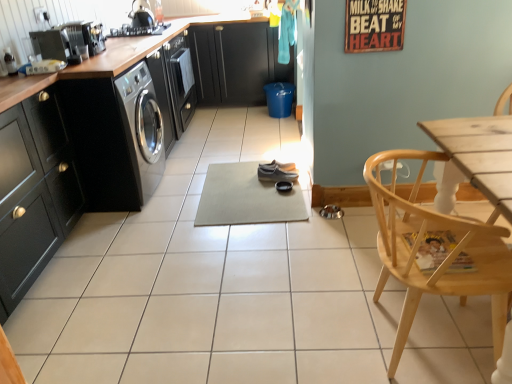
You are a GUI agent. You are given a task and a screenshot of the screen. Output one action in this format:
    pyautogui.click(x=<x>, y=<y>)
    Task: Click on the matte black cabinets at center, the 2th cabinetry from the front
    The width and height of the screenshot is (512, 384).
    Given the screenshot: What is the action you would take?
    pyautogui.click(x=236, y=63)

What do you see at coordinates (111, 58) in the screenshot? Image resolution: width=512 pixels, height=384 pixels. I see `wooden at left` at bounding box center [111, 58].

Measure the distance between metallic silver toaster at upper left and camera.

metallic silver toaster at upper left is 2.45 meters from camera.

What do you see at coordinates (246, 198) in the screenshot? I see `beige rubber yoga mat at center` at bounding box center [246, 198].

You are a GUI agent. You are given a task and a screenshot of the screen. Output one action in this format:
    pyautogui.click(x=<x>, y=<y>)
    Task: Click on the shiny black kettle at upper left
    The width and height of the screenshot is (512, 384).
    Given the screenshot: What is the action you would take?
    pyautogui.click(x=142, y=14)

Measure the distance between point (295,180) and camera.

9.65 feet.

Identify the location of light wood chair at lower right. (435, 251).

In the scene shown: Is light wood chair at lower right next to matte black cabinet at left, positioned as the 1th cabinetry in left-to-right order, and touching it?

No, light wood chair at lower right is not making contact with matte black cabinet at left, positioned as the 1th cabinetry in left-to-right order.

From a real-world perspective, is light wood chair at lower right physically located above or below matte black cabinet at left, acting as the second cabinetry starting from the top?

From a real-world perspective, light wood chair at lower right is physically below matte black cabinet at left, acting as the second cabinetry starting from the top.

Looking at this image, relative to matte black cabinet at left, positioned as the second cabinetry in back-to-front order, is light wood chair at lower right in front or behind?

Visually, light wood chair at lower right is located in front of matte black cabinet at left, positioned as the second cabinetry in back-to-front order.

Considering the positions of points (379, 225) and (31, 223), is point (379, 225) closer to camera compared to point (31, 223)?

Yes, point (379, 225) is in front of point (31, 223).

Is point (391, 226) positioned before point (289, 179)?

That is True.

Considering the relative positions of light wood chair at lower right and matte gray shoe at center in the image provided, is light wood chair at lower right to the left of matte gray shoe at center from the viewer's perspective?

No, light wood chair at lower right is not to the left of matte gray shoe at center.

Looking at their sizes, would you say light wood chair at lower right is wider or thinner than matte gray shoe at center?

light wood chair at lower right is wider than matte gray shoe at center.

Looking at this image, is light wood chair at lower right directly adjacent to matte gray shoe at center?

There is a gap between light wood chair at lower right and matte gray shoe at center.

Which of these two, shiny black kettle at upper left or matte black cabinets at center, which is the 1th cabinetry from back to front, is thinner?

Thinner between the two is shiny black kettle at upper left.

How different are the orientations of shiny black kettle at upper left and matte black cabinets at center, the 2th cabinetry from the front, in degrees?

83 degrees.

Would you say shiny black kettle at upper left is outside matte black cabinets at center, the 1th cabinetry in the right-to-left sequence?

Indeed, shiny black kettle at upper left is completely outside matte black cabinets at center, the 1th cabinetry in the right-to-left sequence.

Would you say shiny black kettle at upper left is a long distance from matte black cabinets at center, the 1th cabinetry in the right-to-left sequence?

shiny black kettle at upper left is far away from matte black cabinets at center, the 1th cabinetry in the right-to-left sequence.

How distant is shiny black kettle at upper left from light wood chair at lower right?

shiny black kettle at upper left is 3.05 meters away from light wood chair at lower right.

From the image's perspective, between shiny black kettle at upper left and light wood chair at lower right, which one is located above?

shiny black kettle at upper left is shown above in the image.

Is the depth of shiny black kettle at upper left less than that of light wood chair at lower right?

That is False.

Do you think shiny black kettle at upper left is within light wood chair at lower right, or outside of it?

shiny black kettle at upper left is not enclosed by light wood chair at lower right.

Consider the image. Does beige rubber yoga mat at center turn towards matte black cabinets at center, positioned as the 1th cabinetry in top-to-bottom order?

No, beige rubber yoga mat at center is not aimed at matte black cabinets at center, positioned as the 1th cabinetry in top-to-bottom order.

From the picture: Considering the relative positions of beige rubber yoga mat at center and matte black cabinets at center, positioned as the 1th cabinetry in top-to-bottom order, in the image provided, is beige rubber yoga mat at center to the left of matte black cabinets at center, positioned as the 1th cabinetry in top-to-bottom order, from the viewer's perspective?

No, beige rubber yoga mat at center is not to the left of matte black cabinets at center, positioned as the 1th cabinetry in top-to-bottom order.

Can you see beige rubber yoga mat at center touching matte black cabinets at center, positioned as the 1th cabinetry in top-to-bottom order?

beige rubber yoga mat at center and matte black cabinets at center, positioned as the 1th cabinetry in top-to-bottom order, are clearly separated.

Choose the correct answer: Is beige rubber yoga mat at center inside matte black cabinets at center, acting as the second cabinetry starting from the bottom, or outside it?

beige rubber yoga mat at center lies outside matte black cabinets at center, acting as the second cabinetry starting from the bottom.

Visually, is matte gray shoe at center positioned to the left or to the right of light wood chair at lower right?

matte gray shoe at center is to the left of light wood chair at lower right.

Considering the relative sizes of matte gray shoe at center and light wood chair at lower right in the image provided, is matte gray shoe at center smaller than light wood chair at lower right?

Yes.

Does point (265, 170) lie in front of point (450, 272)?

No, (265, 170) is behind (450, 272).

Considering the positions of objects matte gray shoe at center and light wood chair at lower right in the image provided, who is in front, matte gray shoe at center or light wood chair at lower right?

Positioned in front is light wood chair at lower right.

Is matte black cabinets at center, positioned as the 2th cabinetry in left-to-right order, turned away from metallic silver toaster at upper left?

matte black cabinets at center, positioned as the 2th cabinetry in left-to-right order, is not turned away from metallic silver toaster at upper left.

From the image's perspective, does matte black cabinets at center, acting as the second cabinetry starting from the bottom, appear lower than metallic silver toaster at upper left?

No, from the image's perspective, matte black cabinets at center, acting as the second cabinetry starting from the bottom, is not below metallic silver toaster at upper left.

Between matte black cabinets at center, positioned as the 2th cabinetry in left-to-right order, and metallic silver toaster at upper left, which one has smaller size?

Smaller between the two is metallic silver toaster at upper left.

Considering their positions, is matte black cabinets at center, the 1th cabinetry in the right-to-left sequence, located in front of or behind metallic silver toaster at upper left?

Clearly, matte black cabinets at center, the 1th cabinetry in the right-to-left sequence, is behind metallic silver toaster at upper left.

Identify the location of chair beneath the matte black cabinet at left, positioned as the 1th cabinetry in left-to-right order (from a real-world perspective). The width and height of the screenshot is (512, 384). pyautogui.click(x=435, y=251).

Find the location of a particular element. The height and width of the screenshot is (384, 512). chair in front of the matte gray shoe at center is located at coordinates (435, 251).

When comparing their distances from shiny black kettle at upper left, does matte gray shoe at center or beige rubber yoga mat at center seem closer?

matte gray shoe at center is closer to shiny black kettle at upper left.

Looking at this image, based on their spatial positions, is matte gray shoe at center or matte black cabinets at center, acting as the second cabinetry starting from the bottom, further from wooden at left?

Among the two, matte black cabinets at center, acting as the second cabinetry starting from the bottom, is located further to wooden at left.

Estimate the real-world distances between objects in this image. Which object is further from matte gray shoe at center, metallic silver toaster at upper left or matte black cabinets at center, the 1th cabinetry in the right-to-left sequence?

The object further to matte gray shoe at center is matte black cabinets at center, the 1th cabinetry in the right-to-left sequence.

Which object lies further to the anchor point light wood chair at lower right, matte black cabinet at left, positioned as the 1th cabinetry in left-to-right order, or metallic silver toaster at upper left?

Among the two, metallic silver toaster at upper left is located further to light wood chair at lower right.

When comparing their distances from matte black cabinets at center, positioned as the 2th cabinetry in left-to-right order, does beige rubber yoga mat at center or shiny black kettle at upper left seem further?

Based on the image, beige rubber yoga mat at center appears to be further to matte black cabinets at center, positioned as the 2th cabinetry in left-to-right order.

Estimate the real-world distances between objects in this image. Which object is closer to matte black cabinet at left, arranged as the 2th cabinetry when viewed from the right, shiny black kettle at upper left or beige rubber yoga mat at center?

beige rubber yoga mat at center is closer to matte black cabinet at left, arranged as the 2th cabinetry when viewed from the right.

When comparing their distances from wooden at left, does light wood chair at lower right or beige rubber yoga mat at center seem further?

light wood chair at lower right is positioned further to the anchor wooden at left.

Considering their positions, is matte black cabinet at left, marked as the 1th cabinetry in a bottom-to-top arrangement, positioned further to matte gray shoe at center than light wood chair at lower right?

light wood chair at lower right lies further to matte gray shoe at center than the other object.

Locate an element on the screen. countertop between light wood chair at lower right and matte black cabinets at center, the 2th cabinetry from the front, in the front-back direction is located at coordinates (111, 58).

The image size is (512, 384). Identify the location of countertop between metallic silver toaster at upper left and shiny black kettle at upper left along the z-axis. (111, 58).

Locate an element on the screen. Image resolution: width=512 pixels, height=384 pixels. countertop between matte black cabinet at left, positioned as the second cabinetry in back-to-front order, and matte gray shoe at center, along the z-axis is located at coordinates (111, 58).

Find the location of a particular element. Image resolution: width=512 pixels, height=384 pixels. countertop between metallic silver toaster at upper left and light wood chair at lower right in the horizontal direction is located at coordinates (111, 58).